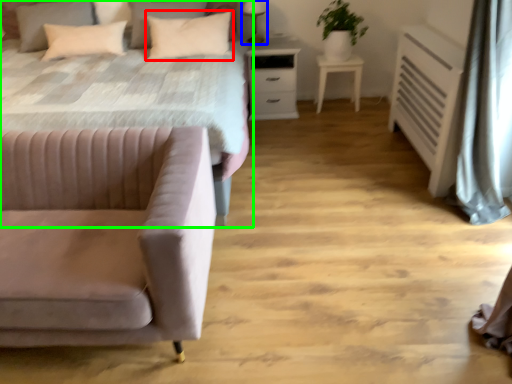
Question: Based on their relative distances, which object is farther from pillow (highlighted by a red box)? Choose from table lamp (highlighted by a blue box) and bed (highlighted by a green box).

Choices:
 (A) table lamp
 (B) bed

Answer: (B)